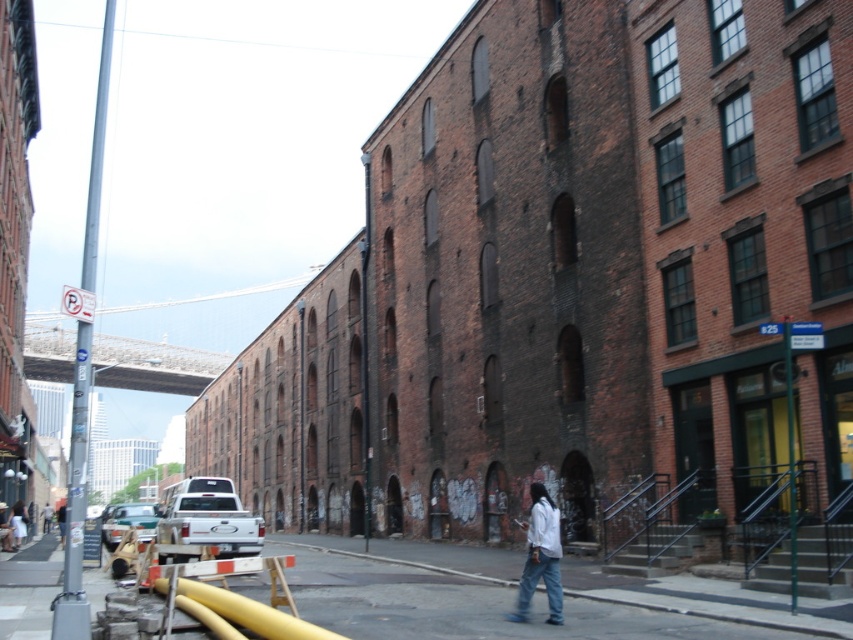
Question: Which of the following is the closest to the observer?

Choices:
 (A) (550, 611)
 (B) (741, 618)

Answer: (B)

Question: Does smooth asphalt road at center appear on the left side of white matte shirt at center?

Choices:
 (A) yes
 (B) no

Answer: (A)

Question: Considering the relative positions of smooth asphalt road at center and white matte shirt at center in the image provided, where is smooth asphalt road at center located with respect to white matte shirt at center?

Choices:
 (A) below
 (B) above

Answer: (A)

Question: Can you confirm if smooth asphalt road at center is bigger than white matte shirt at center?

Choices:
 (A) no
 (B) yes

Answer: (B)